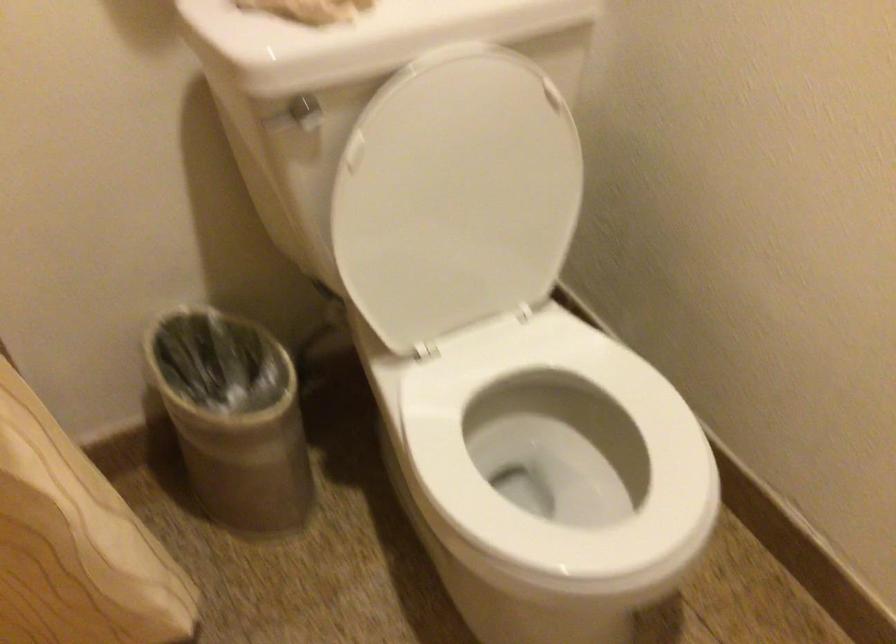
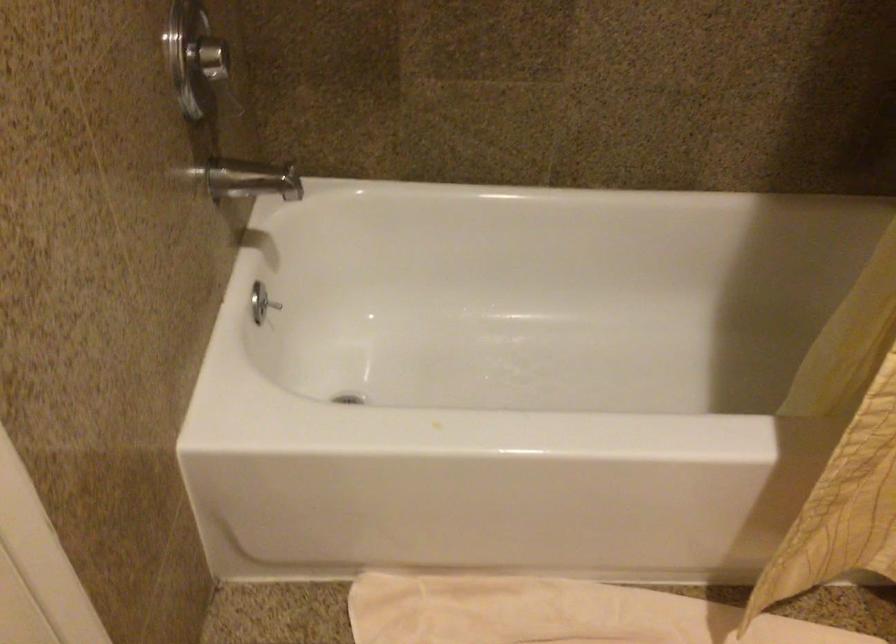
Based on the photo, based on the continuous images, in which direction is the camera rotating?

The camera's rotation is toward left-down.